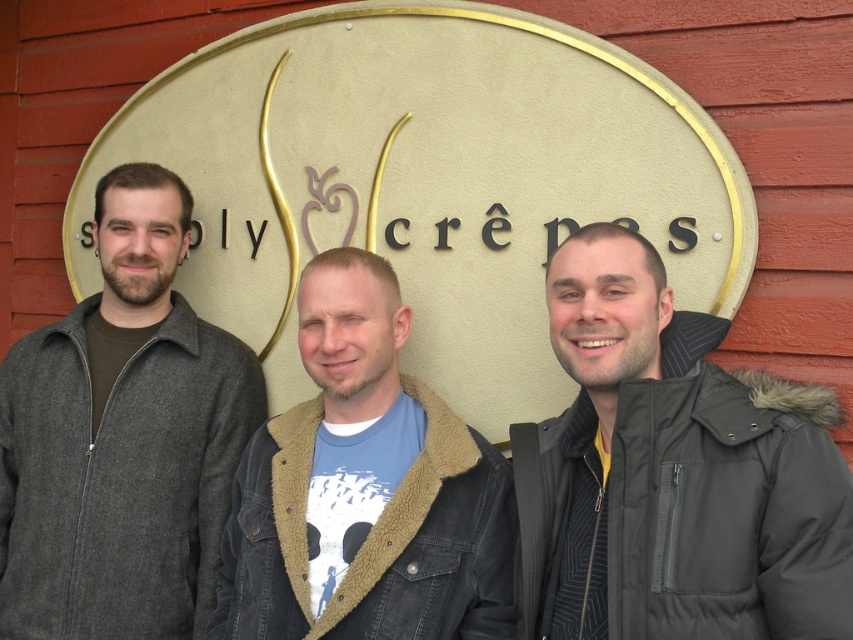
Question: Where is dark gray woolen jacket at left located in relation to denim jacket at center in the image?

Choices:
 (A) below
 (B) above

Answer: (B)

Question: Which object is the closest to the dark gray puffy jacket at center?

Choices:
 (A) denim jacket at center
 (B) matte gold sign at center
 (C) dark gray woolen jacket at left

Answer: (A)

Question: Which of these objects is positioned farthest from the dark gray puffy jacket at center?

Choices:
 (A) matte gold sign at center
 (B) denim jacket at center
 (C) dark gray woolen jacket at left

Answer: (C)

Question: Is dark gray puffy jacket at center wider than dark gray woolen jacket at left?

Choices:
 (A) no
 (B) yes

Answer: (A)

Question: Which of the following is the farthest from the observer?

Choices:
 (A) denim jacket at center
 (B) dark gray woolen jacket at left
 (C) matte gold sign at center

Answer: (B)

Question: Can you confirm if dark gray puffy jacket at center is positioned to the right of denim jacket at center?

Choices:
 (A) no
 (B) yes

Answer: (B)